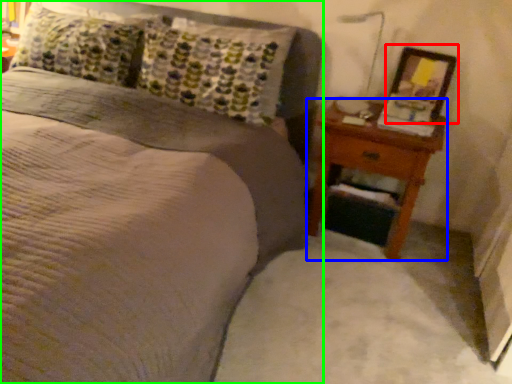
Question: Which is nearer to the picture frame (highlighted by a red box)? nightstand (highlighted by a blue box) or bed (highlighted by a green box).

Choices:
 (A) nightstand
 (B) bed

Answer: (A)